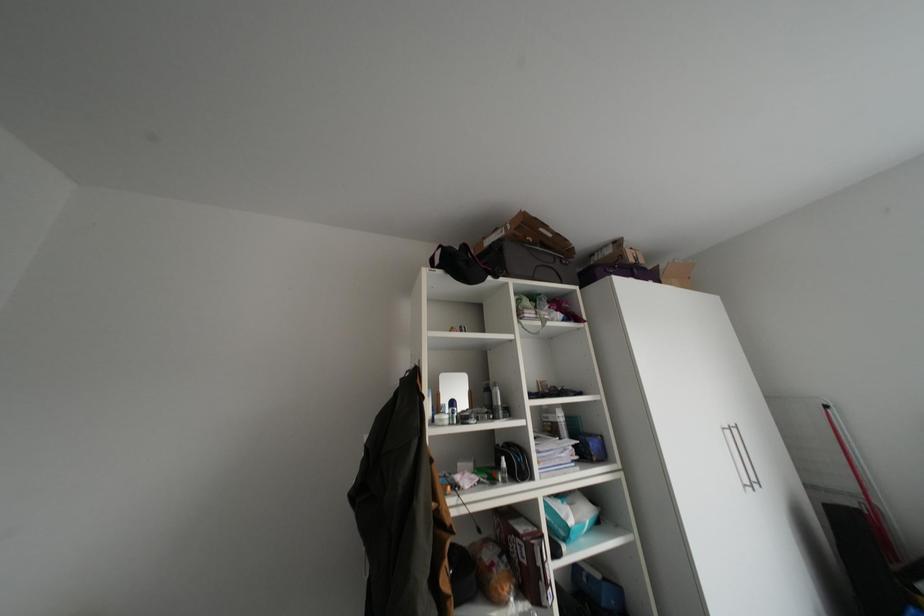
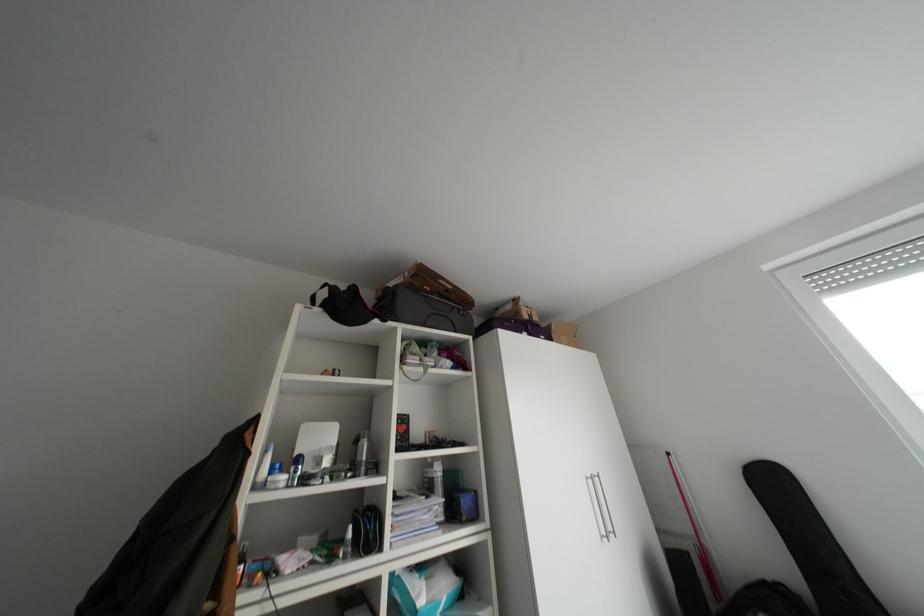
Question: Based on the continuous images, in which direction is the camera rotating? Reply with the corresponding letter.

Choices:
 (A) Left
 (B) Right
 (C) Up
 (D) Down

Answer: (B)